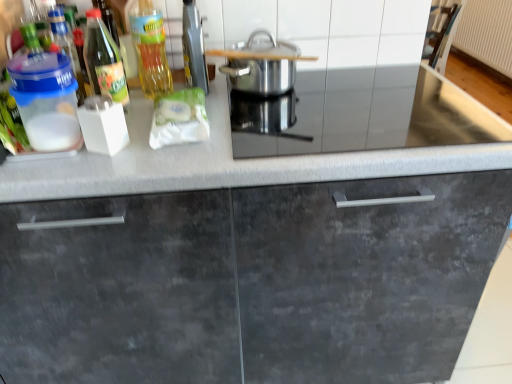
You are a GUI agent. You are given a task and a screenshot of the screen. Output one action in this format:
    pyautogui.click(x=<x>, y=<y>)
    Task: Click on the free location in front of white matte packet at center
    
    Given the screenshot: What is the action you would take?
    pyautogui.click(x=165, y=165)